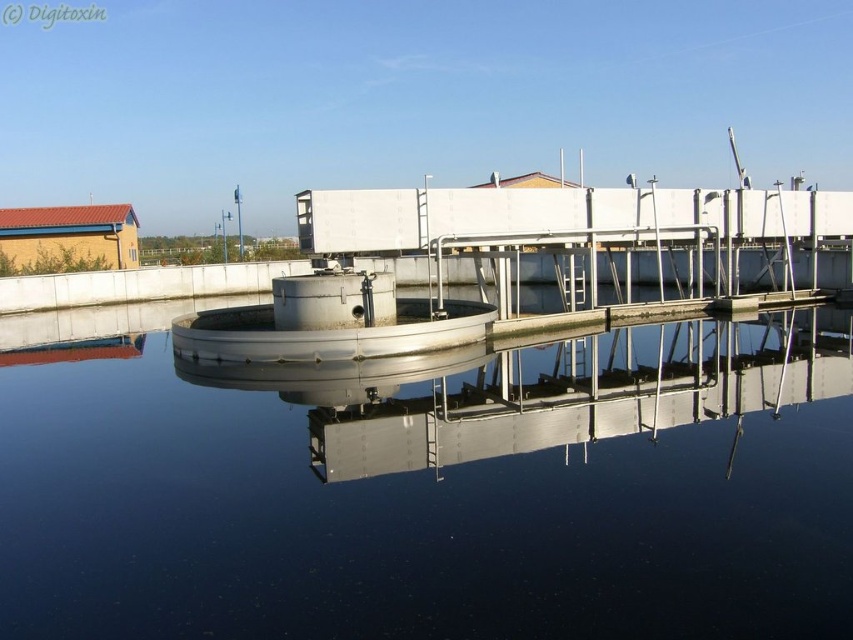
Question: Which object is closer to the camera taking this photo?

Choices:
 (A) metallic water at center
 (B) metallic silver platform at center

Answer: (A)

Question: From the image, what is the correct spatial relationship of metallic water at center in relation to metallic silver platform at center?

Choices:
 (A) below
 (B) above

Answer: (A)

Question: Which point appears closest to the camera in this image?

Choices:
 (A) (438, 518)
 (B) (592, 397)

Answer: (A)

Question: Where is metallic water at center located in relation to metallic silver platform at center in the image?

Choices:
 (A) below
 (B) above

Answer: (A)

Question: Considering the relative positions of metallic water at center and metallic silver platform at center in the image provided, where is metallic water at center located with respect to metallic silver platform at center?

Choices:
 (A) right
 (B) left

Answer: (B)